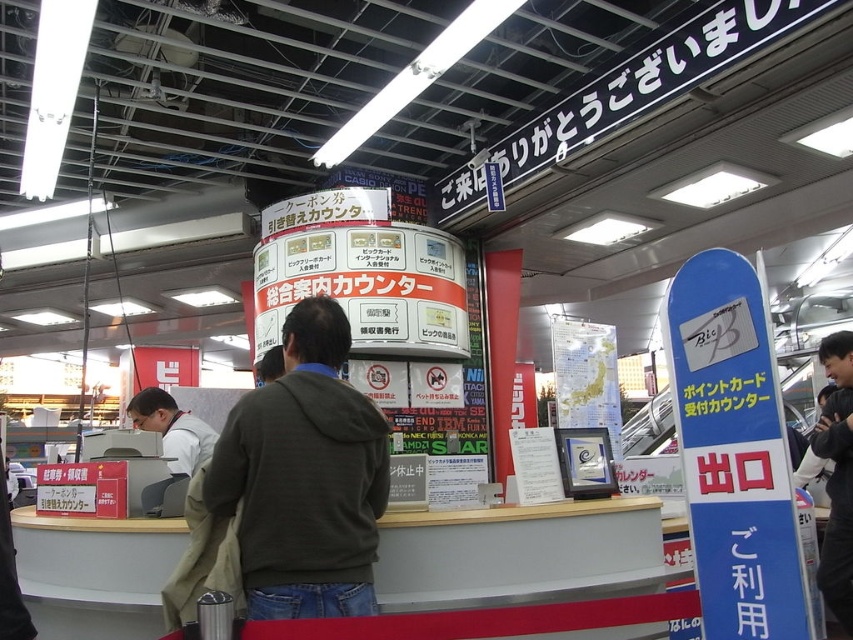
You are a store employee who needs to determine which clothing item takes up more space on the counter. Based on the scene, which item is bigger between the dark gray hoodie at center and the white shirt at center?

The dark gray hoodie at center has a larger size compared to the white shirt at center, so the dark gray hoodie at center takes up more space on the counter.